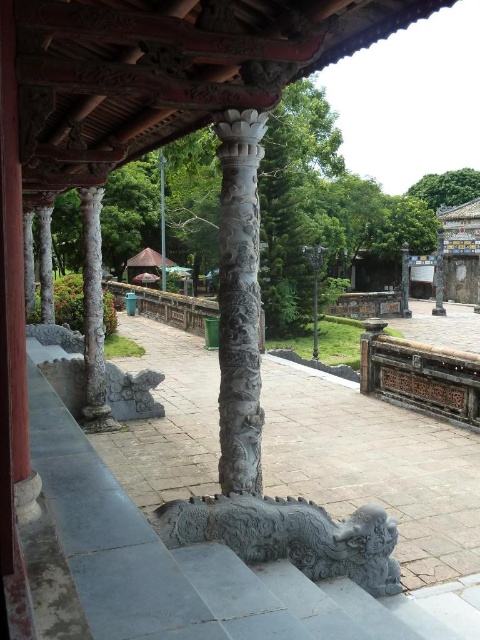
Question: Considering the relative positions of white stone column at left and brown wooden canopy at upper center in the image provided, where is white stone column at left located with respect to brown wooden canopy at upper center?

Choices:
 (A) left
 (B) right

Answer: (B)

Question: Which of the following is the farthest from the observer?

Choices:
 (A) (90, 225)
 (B) (166, 260)
 (C) (50, 304)
 (D) (194, 522)

Answer: (B)

Question: Does carved stone column at left appear over brown wooden canopy at upper center?

Choices:
 (A) yes
 (B) no

Answer: (B)

Question: Is white stone column at left to the left of slate gray stone column at left from the viewer's perspective?

Choices:
 (A) yes
 (B) no

Answer: (B)

Question: Estimate the real-world distances between objects in this image. Which object is farther from the gray stone dragon at lower center?

Choices:
 (A) carved stone column at center
 (B) carved stone column at left
 (C) slate gray stone column at left
 (D) carved stone pillar at center

Answer: (D)

Question: Which point is closer to the camera taking this photo?

Choices:
 (A) (159, 193)
 (B) (325, 538)

Answer: (B)